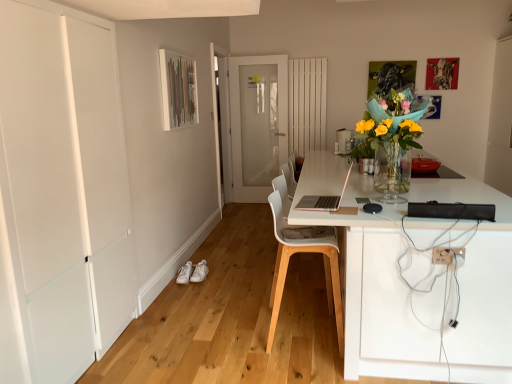
Question: Is white plastic electric outlet at lower right shorter than white leather shoe at lower center, placed as the 1th shoe when sorted from right to left?

Choices:
 (A) yes
 (B) no

Answer: (A)

Question: Can you confirm if white plastic electric outlet at lower right is positioned to the right of white leather shoe at lower center, the 2th shoe from the left?

Choices:
 (A) no
 (B) yes

Answer: (B)

Question: Is white plastic electric outlet at lower right to the left of white leather shoe at lower center, placed as the 1th shoe when sorted from right to left, from the viewer's perspective?

Choices:
 (A) yes
 (B) no

Answer: (B)

Question: Is white plastic electric outlet at lower right facing towards white leather shoe at lower center, the 2th shoe from the left?

Choices:
 (A) no
 (B) yes

Answer: (A)

Question: Is white plastic electric outlet at lower right positioned with its back to white leather shoe at lower center, the 2th shoe from the left?

Choices:
 (A) no
 (B) yes

Answer: (A)

Question: From a real-world perspective, is white matte door at left, which ranks as the second door in right-to-left order, positioned above or below pink matte laptop at center?

Choices:
 (A) below
 (B) above

Answer: (A)

Question: From their relative heights in the image, would you say white matte door at left, the 2th door when ordered from back to front, is taller or shorter than pink matte laptop at center?

Choices:
 (A) short
 (B) tall

Answer: (B)

Question: Is white matte door at left, which ranks as the first door in front-to-back order, in front of or behind pink matte laptop at center in the image?

Choices:
 (A) behind
 (B) front

Answer: (B)

Question: Looking at their shapes, would you say white matte door at left, which ranks as the second door in right-to-left order, is wider or thinner than pink matte laptop at center?

Choices:
 (A) thin
 (B) wide

Answer: (A)

Question: From a real-world perspective, relative to pink matte laptop at center, is white plastic electric outlet at lower right vertically above or below?

Choices:
 (A) above
 (B) below

Answer: (B)

Question: Based on their sizes in the image, would you say white plastic electric outlet at lower right is bigger or smaller than pink matte laptop at center?

Choices:
 (A) small
 (B) big

Answer: (A)

Question: In the image, is white plastic electric outlet at lower right positioned in front of or behind pink matte laptop at center?

Choices:
 (A) behind
 (B) front

Answer: (B)

Question: Do you think white plastic electric outlet at lower right is within pink matte laptop at center, or outside of it?

Choices:
 (A) outside
 (B) inside

Answer: (A)

Question: Considering their positions, is white plastic chair at center located in front of or behind white leather shoe at lower center, the 2th shoe from the left?

Choices:
 (A) behind
 (B) front

Answer: (B)

Question: From the image's perspective, is white plastic chair at center positioned above or below white leather shoe at lower center, the 2th shoe from the left?

Choices:
 (A) above
 (B) below

Answer: (A)